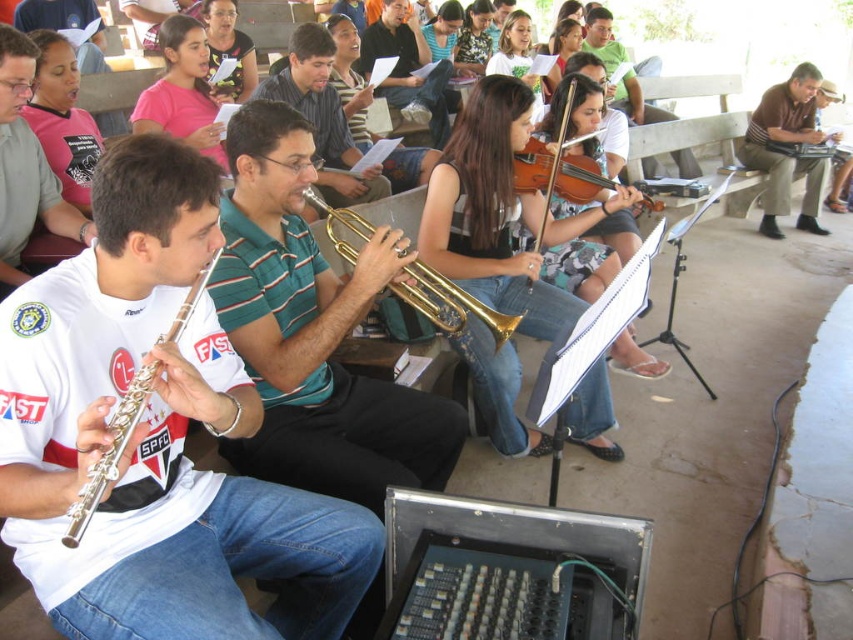
Is shiny brass trumpet at center bigger than wooden violin at center?

Indeed, shiny brass trumpet at center has a larger size compared to wooden violin at center.

Between point (271, 468) and point (556, 188), which one is positioned in front?

Point (271, 468)

Find the location of a particular element. shiny brass trumpet at center is located at coordinates (314, 332).

Is shiny green shirt at center above silver metallic trumpet at center?

Yes.

Who is positioned more to the left, shiny green shirt at center or silver metallic trumpet at center?

Positioned to the left is shiny green shirt at center.

What do you see at coordinates (322, 115) in the screenshot? This screenshot has height=640, width=853. I see `shiny green shirt at center` at bounding box center [322, 115].

Locate an element on the screen. Image resolution: width=853 pixels, height=640 pixels. shiny green shirt at center is located at coordinates (322, 115).

Which is more to the left, silver metallic flute at left or brown cotton shirt at upper right?

silver metallic flute at left

Who is shorter, silver metallic flute at left or brown cotton shirt at upper right?

With less height is silver metallic flute at left.

Measure the distance between point (155, 220) and camera.

Point (155, 220) and camera are 4.30 feet apart from each other.

This screenshot has height=640, width=853. I want to click on silver metallic flute at left, so click(x=155, y=436).